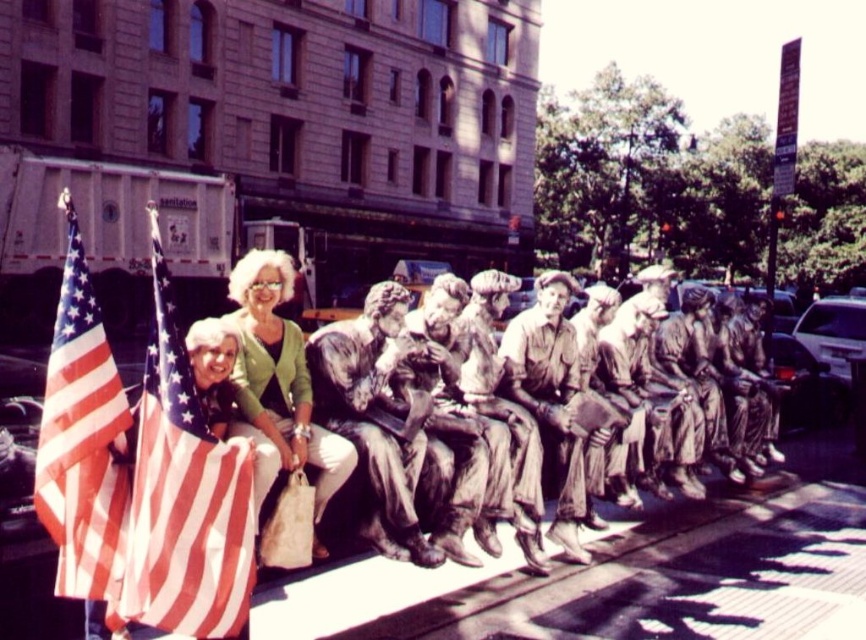
Question: Is bronze statue at center above matte green sweater at center?

Choices:
 (A) no
 (B) yes

Answer: (A)

Question: Does bronze statue at center have a lesser width compared to matte green sweater at center?

Choices:
 (A) no
 (B) yes

Answer: (A)

Question: Does american flag at left have a larger size compared to bronze statue at center?

Choices:
 (A) no
 (B) yes

Answer: (A)

Question: Which point is farther from the camera taking this photo?

Choices:
 (A) (430, 333)
 (B) (327, 470)
 (C) (178, 570)
 (D) (108, 477)

Answer: (A)

Question: Which point is farther to the camera?

Choices:
 (A) (207, 456)
 (B) (241, 337)

Answer: (B)

Question: Which of the following is the farthest from the observer?

Choices:
 (A) (163, 340)
 (B) (453, 342)
 (C) (107, 540)
 (D) (326, 490)

Answer: (B)